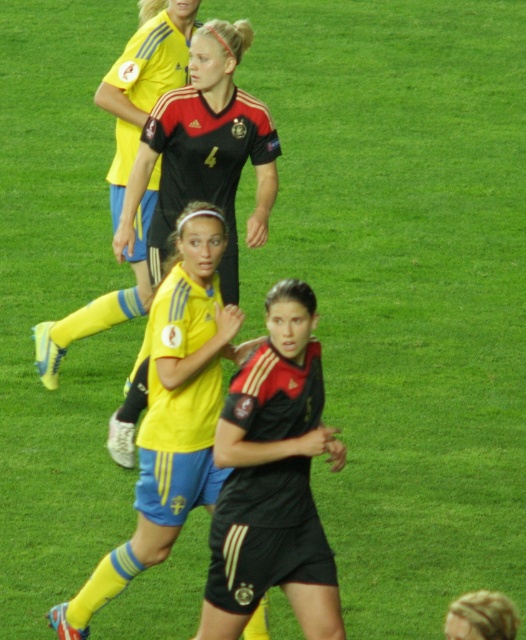
Does yellow matte jersey at center lie behind black matte jersey at upper center?

No, yellow matte jersey at center is in front of black matte jersey at upper center.

Does yellow matte jersey at center have a smaller size compared to black matte jersey at upper center?

No.

What do you see at coordinates (171, 412) in the screenshot?
I see `yellow matte jersey at center` at bounding box center [171, 412].

In order to click on yellow matte jersey at center in this screenshot , I will do `click(171, 412)`.